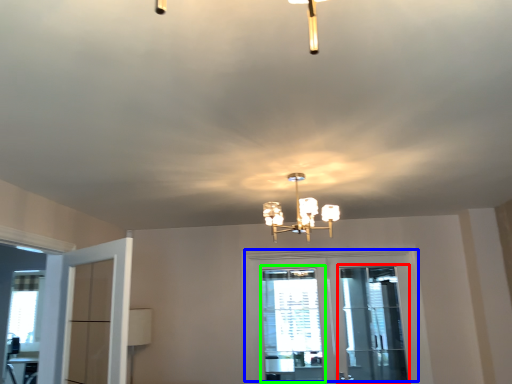
Question: Which object is positioned closest to screen door (highlighted by a red box)? Select from door (highlighted by a blue box) and window (highlighted by a green box).

Choices:
 (A) door
 (B) window

Answer: (A)